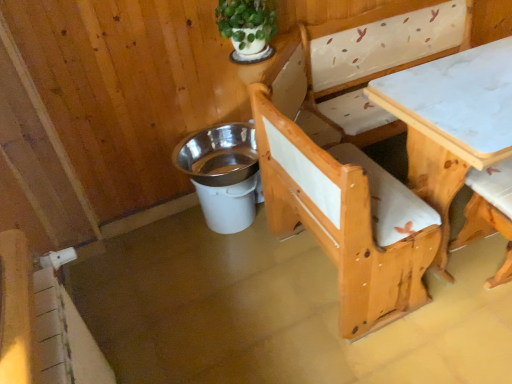
Question: Considering the relative sizes of green matte plant at upper center and white marble table at center in the image provided, is green matte plant at upper center wider than white marble table at center?

Choices:
 (A) no
 (B) yes

Answer: (A)

Question: Is green matte plant at upper center in front of white marble table at center?

Choices:
 (A) no
 (B) yes

Answer: (A)

Question: Does green matte plant at upper center have a smaller size compared to white marble table at center?

Choices:
 (A) no
 (B) yes

Answer: (B)

Question: Can you see green matte plant at upper center touching white marble table at center?

Choices:
 (A) no
 (B) yes

Answer: (A)

Question: From the image's perspective, is green matte plant at upper center under white marble table at center?

Choices:
 (A) no
 (B) yes

Answer: (A)

Question: Considering their positions, is green matte plant at upper center located in front of or behind white marble table at center?

Choices:
 (A) front
 (B) behind

Answer: (B)

Question: From the image's perspective, is green matte plant at upper center positioned above or below white marble table at center?

Choices:
 (A) above
 (B) below

Answer: (A)

Question: Is green matte plant at upper center inside the boundaries of white marble table at center, or outside?

Choices:
 (A) outside
 (B) inside

Answer: (A)

Question: From a real-world perspective, is green matte plant at upper center physically located above or below white marble table at center?

Choices:
 (A) below
 (B) above

Answer: (B)

Question: From the image's perspective, is green matte plant at upper center positioned above or below wooden chair at lower right?

Choices:
 (A) below
 (B) above

Answer: (B)

Question: Considering the positions of point (227, 28) and point (476, 215), is point (227, 28) closer or farther from the camera than point (476, 215)?

Choices:
 (A) farther
 (B) closer

Answer: (B)

Question: Looking at their shapes, would you say green matte plant at upper center is wider or thinner than wooden chair at lower right?

Choices:
 (A) thin
 (B) wide

Answer: (A)

Question: Is green matte plant at upper center situated inside wooden chair at lower right or outside?

Choices:
 (A) inside
 (B) outside

Answer: (B)

Question: In terms of width, does white plastic bucket at lower center look wider or thinner when compared to green matte plant at upper center?

Choices:
 (A) thin
 (B) wide

Answer: (B)

Question: Is white plastic bucket at lower center bigger or smaller than green matte plant at upper center?

Choices:
 (A) big
 (B) small

Answer: (A)